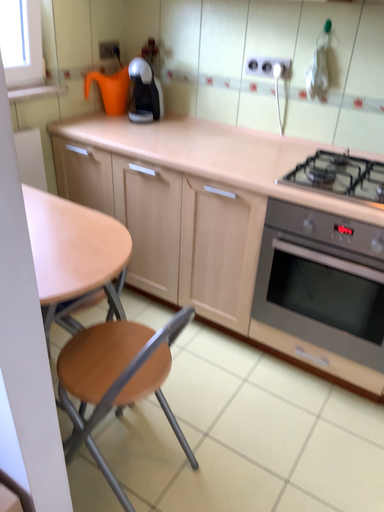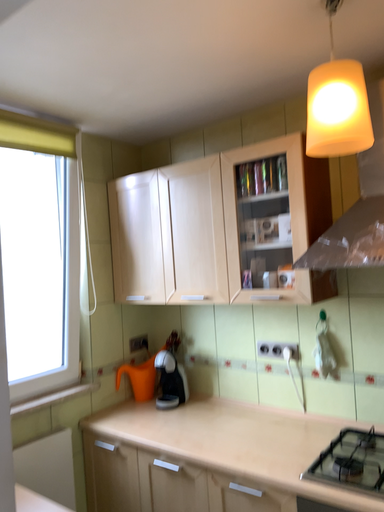
Question: How did the camera likely rotate when shooting the video?

Choices:
 (A) rotated downward
 (B) rotated upward

Answer: (B)